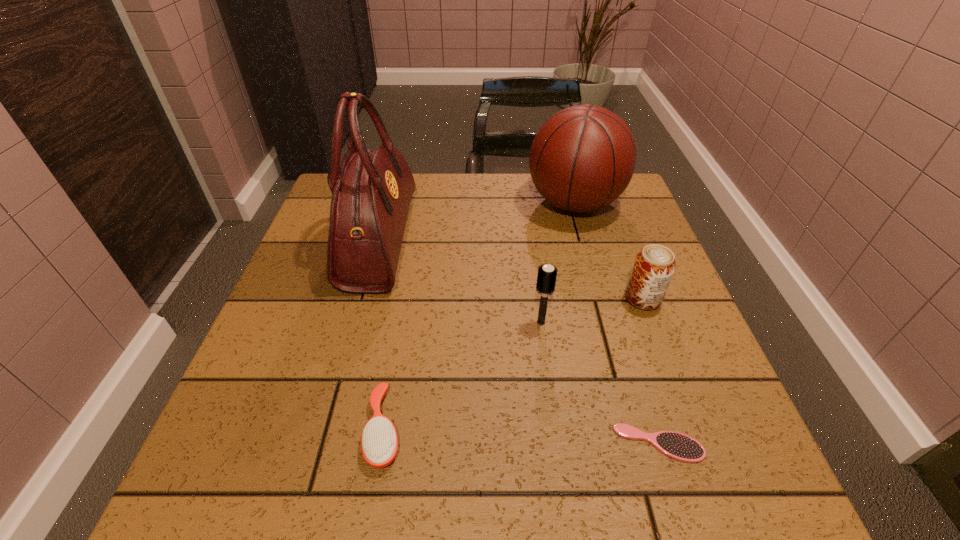
This screenshot has height=540, width=960. What are the coordinates of `hairbrush at the right edge` in the screenshot? It's located at (676, 445).

This screenshot has width=960, height=540. I want to click on object that is at the far left corner, so click(371, 190).

Image resolution: width=960 pixels, height=540 pixels. Identify the location of object that is at the far right corner. (582, 159).

Where is `object that is at the near right corner`? This screenshot has width=960, height=540. object that is at the near right corner is located at coordinates (676, 445).

You are a GUI agent. You are given a task and a screenshot of the screen. Output one action in this format:
    pyautogui.click(x=<x>, y=<y>)
    Task: Click on the free space at the far edge
    The height and width of the screenshot is (540, 960).
    Given the screenshot: What is the action you would take?
    pyautogui.click(x=480, y=211)

I want to click on free point at the near edge, so click(460, 472).

At what (x,y) coordinates should I click in order to perform the action: click on vacant space at the left edge. Please return your answer as a coordinate pair (x, y). The height and width of the screenshot is (540, 960). Looking at the image, I should click on (339, 353).

In the image, there is a desktop. Where is `vacant space at the right edge`? The image size is (960, 540). vacant space at the right edge is located at coordinates (672, 316).

The image size is (960, 540). I want to click on free space at the far right corner, so click(636, 202).

The width and height of the screenshot is (960, 540). I want to click on vacant space at the near right corner of the desktop, so click(677, 501).